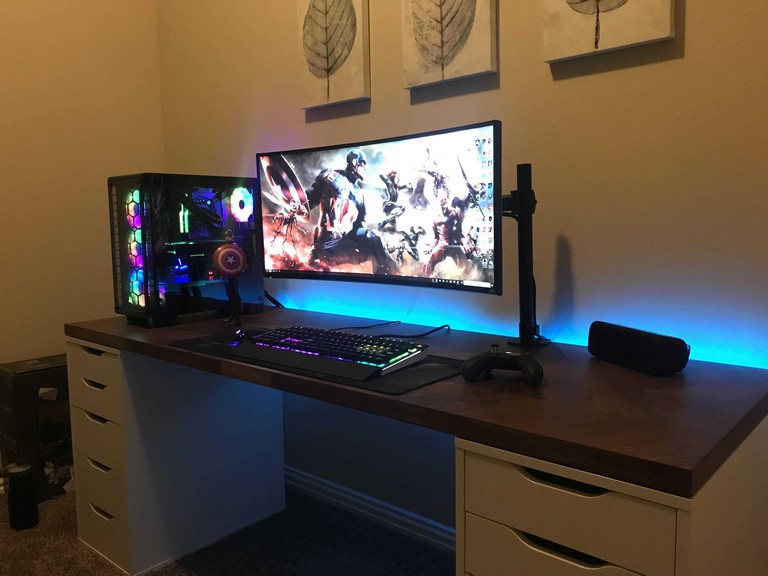
Where is `the third drawer on the left from the top`? the third drawer on the left from the top is located at coordinates pos(107,442).